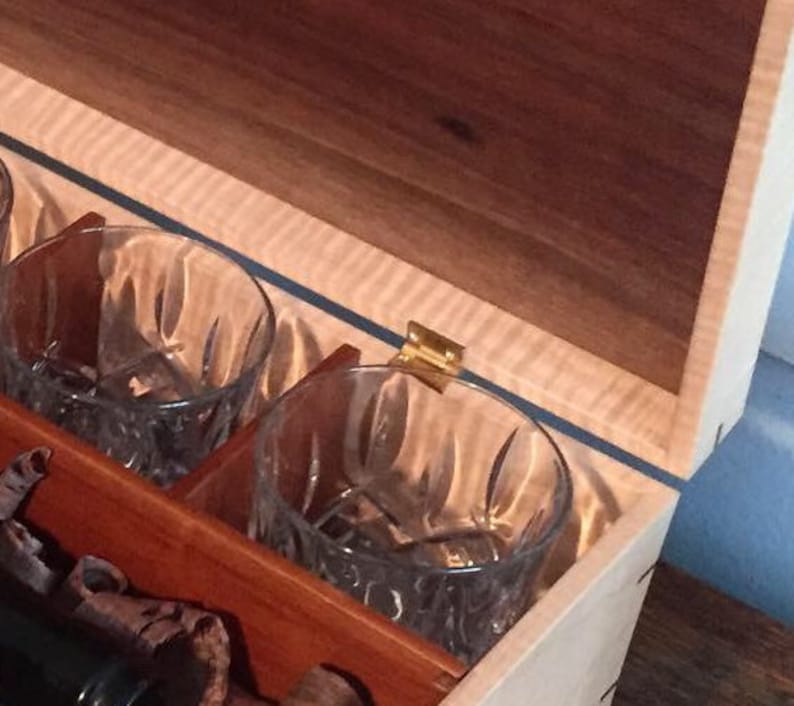
What are the coordinates of `hinge` in the screenshot? It's located at (421, 351).